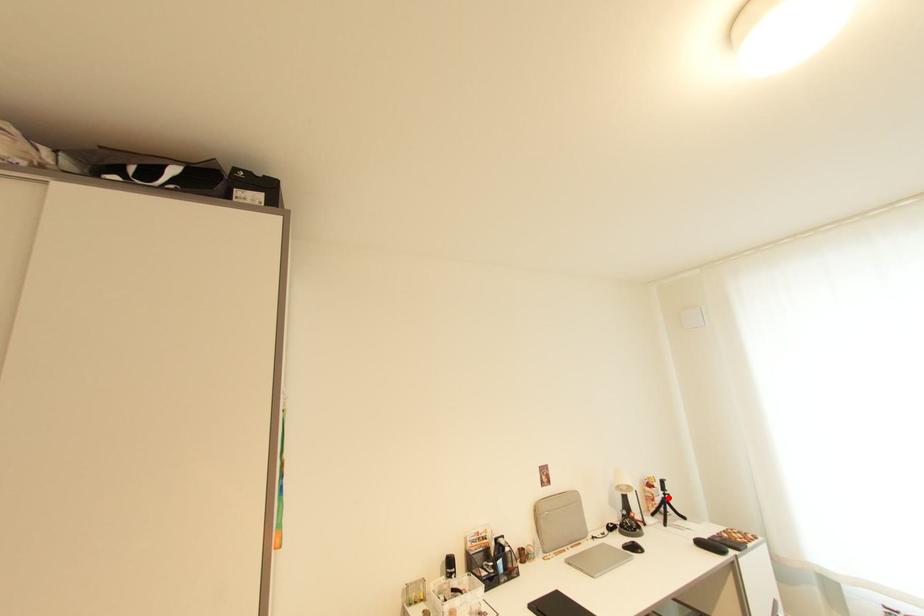
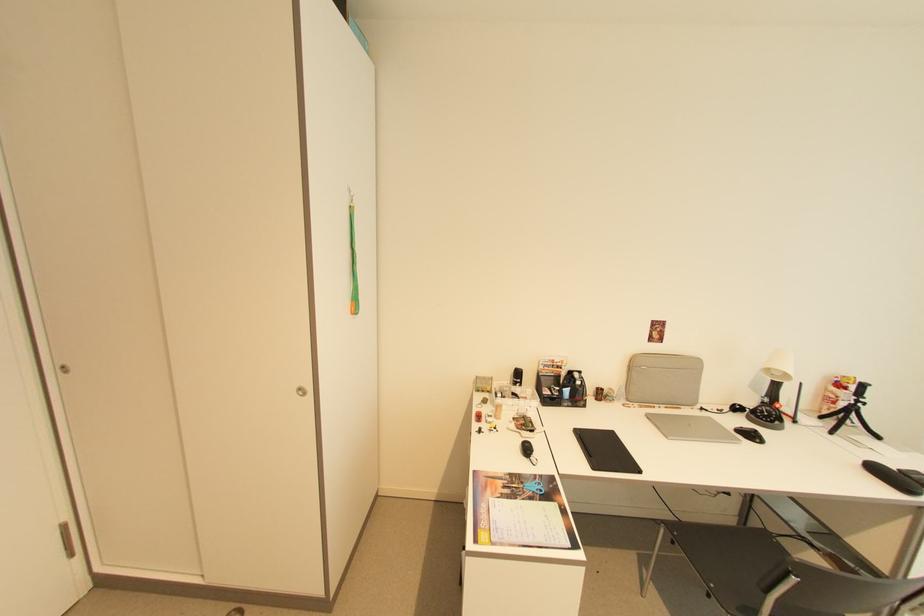
The point at the highlighted location is marked in the first image. Where is the corresponding point in the second image?

(857, 405)